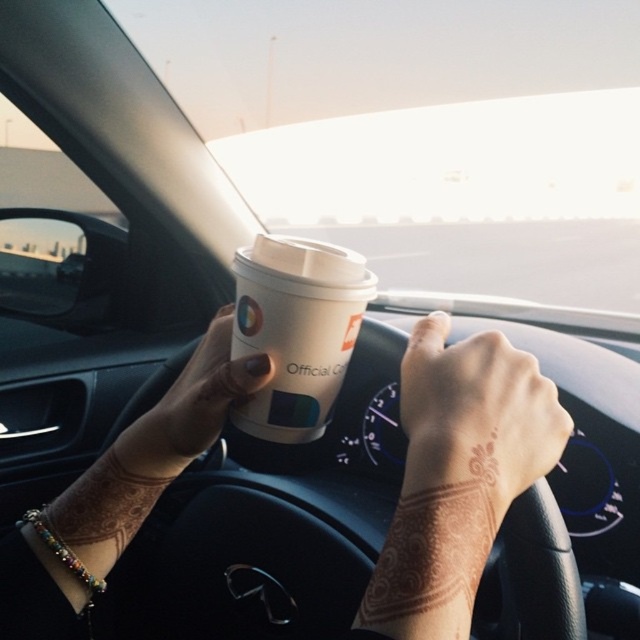
Question: Estimate the real-world distances between objects in this image. Which object is closer to the white paper cup at center?

Choices:
 (A) matte white cup at center
 (B) white paper cup at upper center
 (C) brown henna tattoo at center

Answer: (A)

Question: Which point is closer to the camera?

Choices:
 (A) (138, 467)
 (B) (449, 637)
 (C) (312, 396)

Answer: (B)

Question: Which point is closer to the camera?

Choices:
 (A) white paper cup at upper center
 (B) matte white cup at center
 (C) white paper cup at center
 (D) brown henna tattoo at center

Answer: (A)

Question: Is white paper cup at upper center smaller than matte white cup at center?

Choices:
 (A) yes
 (B) no

Answer: (B)

Question: Is white paper cup at upper center smaller than brown henna tattoo at center?

Choices:
 (A) yes
 (B) no

Answer: (B)

Question: Does white paper cup at upper center have a larger size compared to white paper cup at center?

Choices:
 (A) no
 (B) yes

Answer: (B)